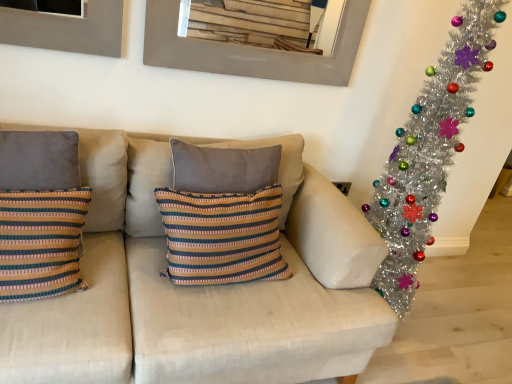
Image resolution: width=512 pixels, height=384 pixels. In order to click on vacant space in metallic gray picture frame at upper center (from a real-world perspective) in this screenshot , I will do `click(228, 113)`.